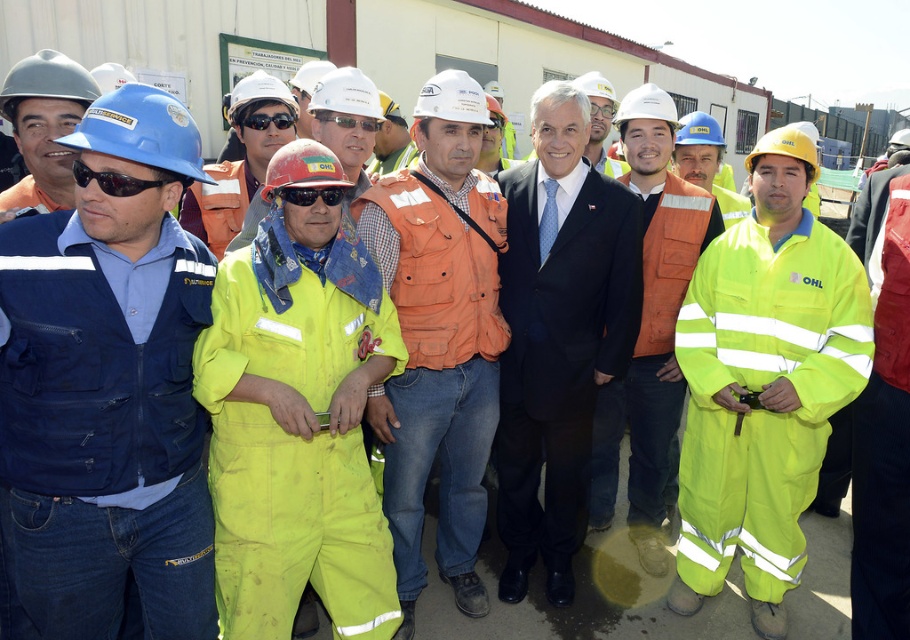
Is point (92, 502) positioned before point (281, 125)?

Yes, point (92, 502) is in front of point (281, 125).

Who is more distant from viewer, [87,532] or [292,120]?

Positioned behind is point [292,120].

Does point (167, 589) come behind point (250, 124)?

No.

Identify the location of blue fabric jacket at left. This screenshot has height=640, width=910. (106, 392).

Can you confirm if matte black suit at center is shorter than blue hard hat at left?

No, matte black suit at center is not shorter than blue hard hat at left.

Between point (585, 100) and point (12, 209), which one is positioned behind?

Point (585, 100)

Does point (541, 131) come behind point (56, 189)?

That is True.

Where is `matte black suit at center`? This screenshot has height=640, width=910. matte black suit at center is located at coordinates (558, 336).

Is neon yellow coveralls at center further to camera compared to blue hard hat at left?

That is True.

Who is higher up, neon yellow coveralls at center or blue hard hat at left?

blue hard hat at left is higher up.

Between point (766, 326) and point (76, 102), which one is positioned behind?

Point (766, 326)

Find the location of `neon yellow coveralls at center`. neon yellow coveralls at center is located at coordinates (763, 384).